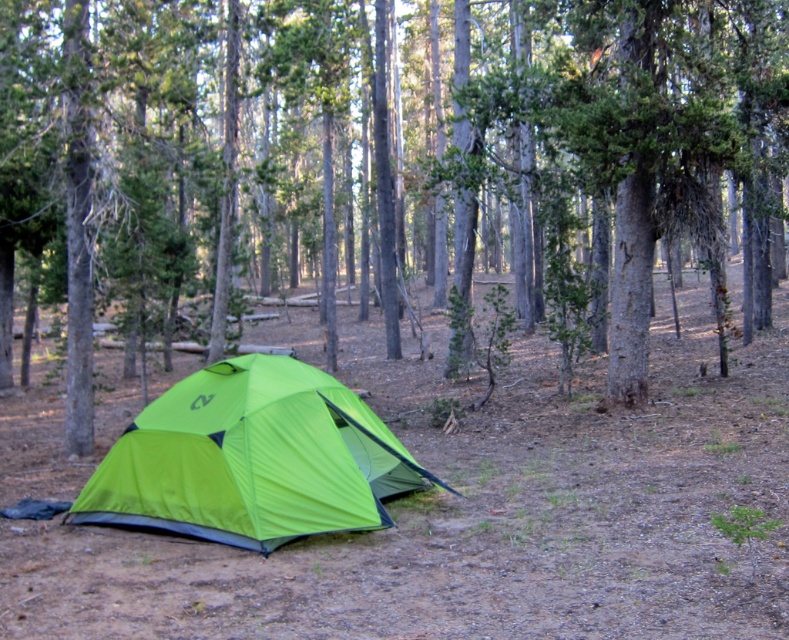
Who is lower down, green fabric tent at center or lime green fabric tent at center?

Positioned lower is lime green fabric tent at center.

Locate an element on the screen. green fabric tent at center is located at coordinates (389, 150).

You are a GUI agent. You are given a task and a screenshot of the screen. Output one action in this format:
    pyautogui.click(x=<x>, y=<y>)
    Task: Click on the green fabric tent at center
    This screenshot has width=789, height=640.
    Given the screenshot: What is the action you would take?
    pyautogui.click(x=389, y=150)